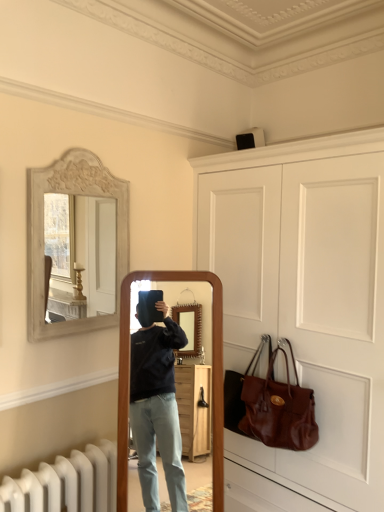
Locate an element on the screen. The width and height of the screenshot is (384, 512). blank space above white carved wood mirror at upper left (from a real-world perspective) is located at coordinates click(80, 145).